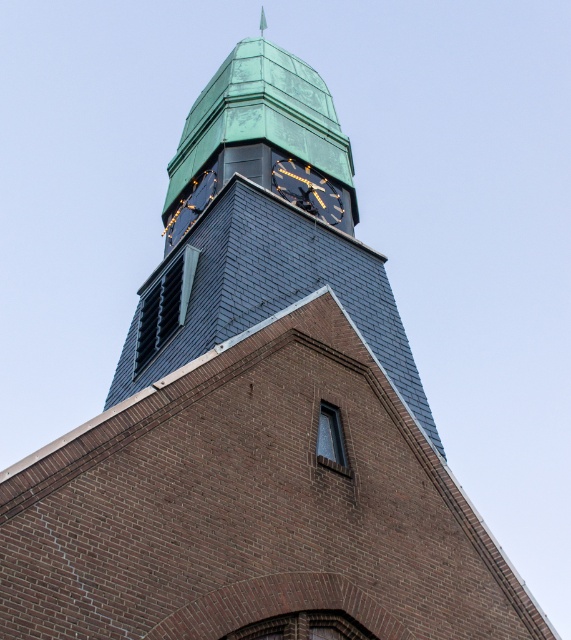
Can you confirm if black metal clock at upper center is positioned below metallic gold clock at upper center?

Incorrect, black metal clock at upper center is not positioned below metallic gold clock at upper center.

Does black metal clock at upper center have a larger size compared to metallic gold clock at upper center?

No.

I want to click on black metal clock at upper center, so click(x=307, y=189).

I want to click on black metal clock at upper center, so click(x=307, y=189).

Is green copper clock tower at upper center taller than metallic gold clock at upper center?

Yes.

Can you confirm if green copper clock tower at upper center is positioned above metallic gold clock at upper center?

Yes.

Which is behind, point (266, 113) or point (182, 216)?

The point (266, 113) is behind.

Find the location of a particular element. green copper clock tower at upper center is located at coordinates (260, 228).

Can you confirm if green copper clock tower at upper center is thinner than black metal clock at upper center?

In fact, green copper clock tower at upper center might be wider than black metal clock at upper center.

Does green copper clock tower at upper center have a greater height compared to black metal clock at upper center?

Yes, green copper clock tower at upper center is taller than black metal clock at upper center.

Is point (424, 396) in front of point (297, 173)?

Yes, it is.

Locate an element on the screen. The image size is (571, 640). green copper clock tower at upper center is located at coordinates pos(260,228).